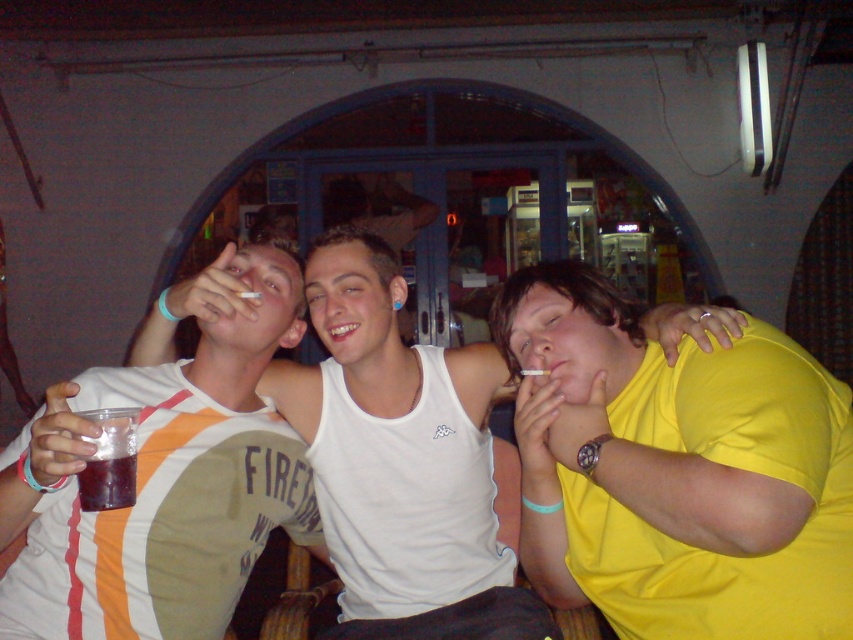
Is white cotton t-shirt at center positioned behind white tank top at center?

That is False.

Can you confirm if white cotton t-shirt at center is taller than white tank top at center?

No, white cotton t-shirt at center is not taller than white tank top at center.

Is point (141, 525) positioned behind point (144, 330)?

No, (141, 525) is in front of (144, 330).

In order to click on white cotton t-shirt at center in this screenshot , I will do `click(164, 483)`.

Is yellow matte shirt at center wider than white tank top at center?

Incorrect, yellow matte shirt at center's width does not surpass white tank top at center's.

Does yellow matte shirt at center appear over white tank top at center?

Actually, yellow matte shirt at center is below white tank top at center.

Does point (566, 360) come in front of point (329, 234)?

That is True.

This screenshot has width=853, height=640. I want to click on yellow matte shirt at center, so click(x=676, y=468).

Does white tank top at center have a smaller size compared to dark purple liquid at lower left?

No, white tank top at center is not smaller than dark purple liquid at lower left.

Between white tank top at center and dark purple liquid at lower left, which one appears on the left side from the viewer's perspective?

From the viewer's perspective, dark purple liquid at lower left appears more on the left side.

Where is `white tank top at center`? white tank top at center is located at coordinates (363, 321).